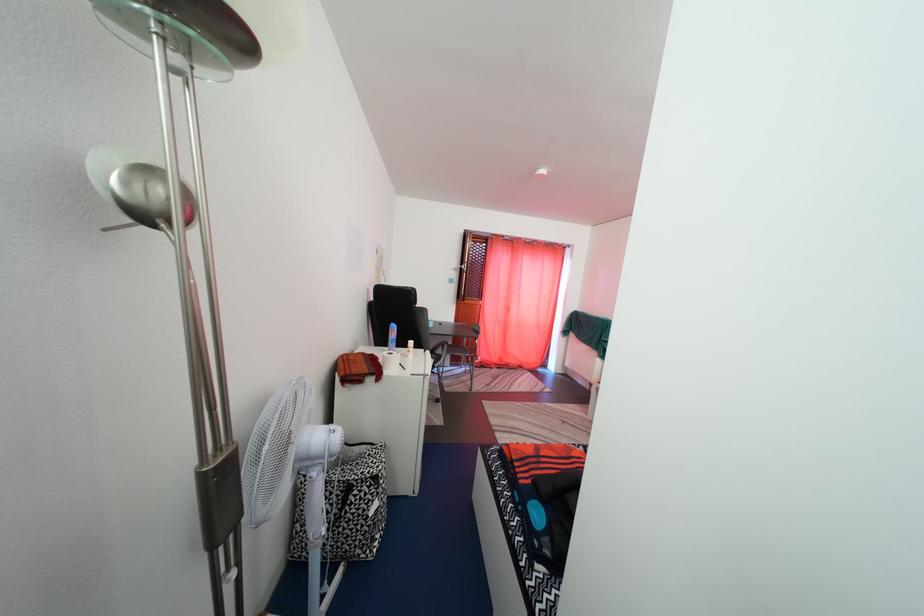
The height and width of the screenshot is (616, 924). What do you see at coordinates (442, 355) in the screenshot?
I see `a chair armrest` at bounding box center [442, 355].